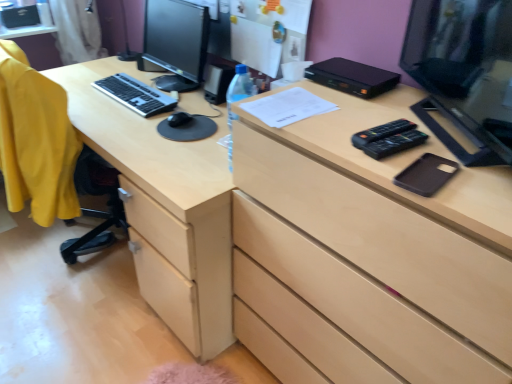
At what (x,y) coordinates should I click in order to perform the action: click on vacant region to the left of black matte phone case at right. Please return your answer as a coordinate pair (x, y). The height and width of the screenshot is (384, 512). Looking at the image, I should click on (358, 153).